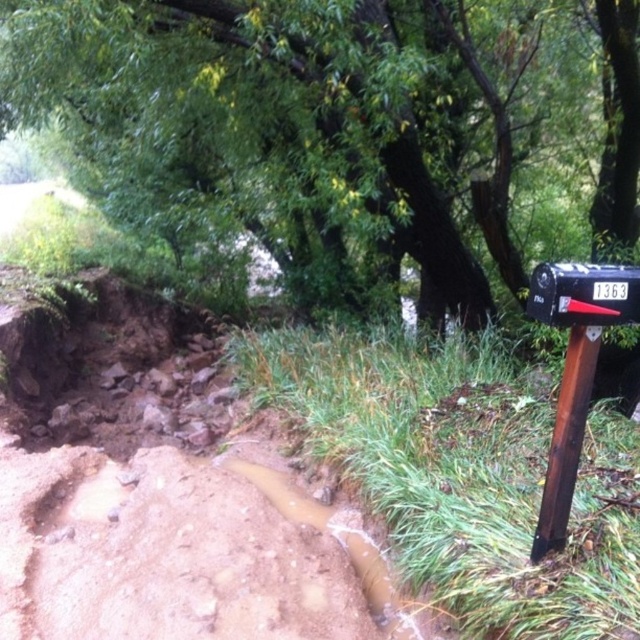
Question: Which point appears farthest from the camera in this image?

Choices:
 (A) (346, 264)
 (B) (577, 392)

Answer: (A)

Question: Does green leafy tree at upper center have a larger size compared to brown wooden post at right?

Choices:
 (A) yes
 (B) no

Answer: (A)

Question: Among these objects, which one is nearest to the camera?

Choices:
 (A) brown wooden post at right
 (B) green leafy tree at upper center

Answer: (A)

Question: Is green leafy tree at upper center closer to camera compared to brown wooden post at right?

Choices:
 (A) no
 (B) yes

Answer: (A)

Question: Is green leafy tree at upper center below brown wooden post at right?

Choices:
 (A) yes
 (B) no

Answer: (B)